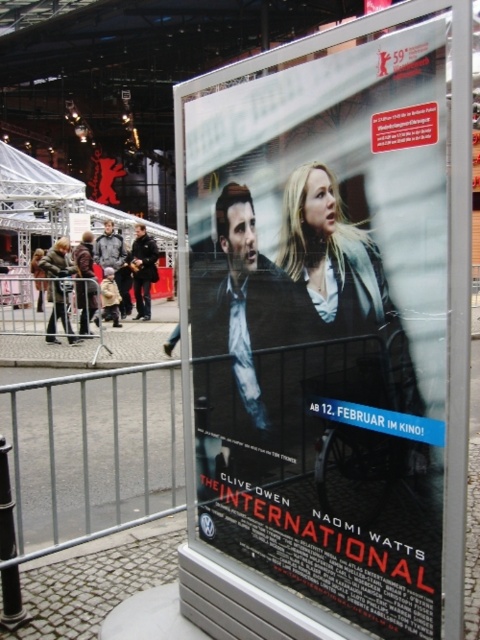
Question: Which point appears closest to the camera in this image?

Choices:
 (A) (276, 419)
 (B) (151, 243)
 (C) (424, 605)

Answer: (C)

Question: Which object is closer to the camera taking this photo?

Choices:
 (A) metallic silver poster at center
 (B) matte black suit at center
 (C) dark brown leather jacket at center
 (D) dark gray jacket at center

Answer: (A)

Question: Is matte black suit at center below dark gray jacket at center?

Choices:
 (A) no
 (B) yes

Answer: (B)

Question: Considering the relative positions of matte black suit at center and dark gray jacket at center in the image provided, where is matte black suit at center located with respect to dark gray jacket at center?

Choices:
 (A) left
 (B) right

Answer: (B)

Question: Is matte black suit at center in front of dark brown leather jacket at center?

Choices:
 (A) yes
 (B) no

Answer: (A)

Question: Which of the following is the farthest from the observer?

Choices:
 (A) (133, 262)
 (B) (105, 252)

Answer: (B)